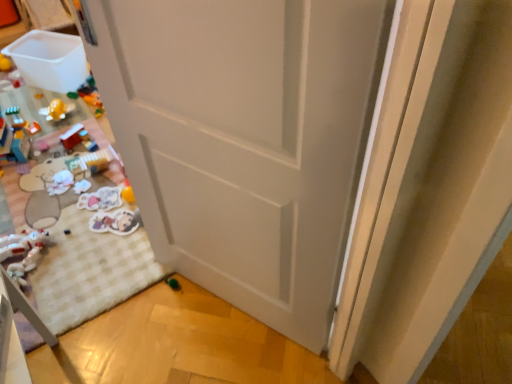
Question: In terms of width, does matte plastic stickers at lower left, which ranks as the sixth toy in left-to-right order, look wider or thinner when compared to white plush toy at lower left, marked as the 7th toy in a right-to-left arrangement?

Choices:
 (A) thin
 (B) wide

Answer: (A)

Question: In the image, is matte plastic stickers at lower left, marked as the third toy in a right-to-left arrangement, on the left side or the right side of white plush toy at lower left, which is counted as the 2th toy, starting from the left?

Choices:
 (A) right
 (B) left

Answer: (A)

Question: Which is nearer to the matte plastic toy at lower left, the 6th toy when ordered from right to left?

Choices:
 (A) matte plastic stickers at lower left, marked as the third toy in a right-to-left arrangement
 (B) translucent plastic toy at left, which is the 8th toy from right to left
 (C) white matte door at center
 (D) matte plastic stickers at lower left, positioned as the 2th toy in right-to-left order
 (E) matte black toy at lower left, the 5th toy in the left-to-right sequence

Answer: (B)

Question: Estimate the real-world distances between objects in this image. Which object is closer to the green rubber toy at lower center, the eighth toy in the left-to-right sequence?

Choices:
 (A) matte black toy at lower left, the 5th toy in the left-to-right sequence
 (B) white plush toy at lower left, which ranks as the fifth toy in right-to-left order
 (C) matte plastic stickers at lower left, positioned as the 2th toy in right-to-left order
 (D) matte plastic toy at lower left, the 6th toy when ordered from right to left
 (E) white plush toy at lower left, which is counted as the 2th toy, starting from the left

Answer: (C)